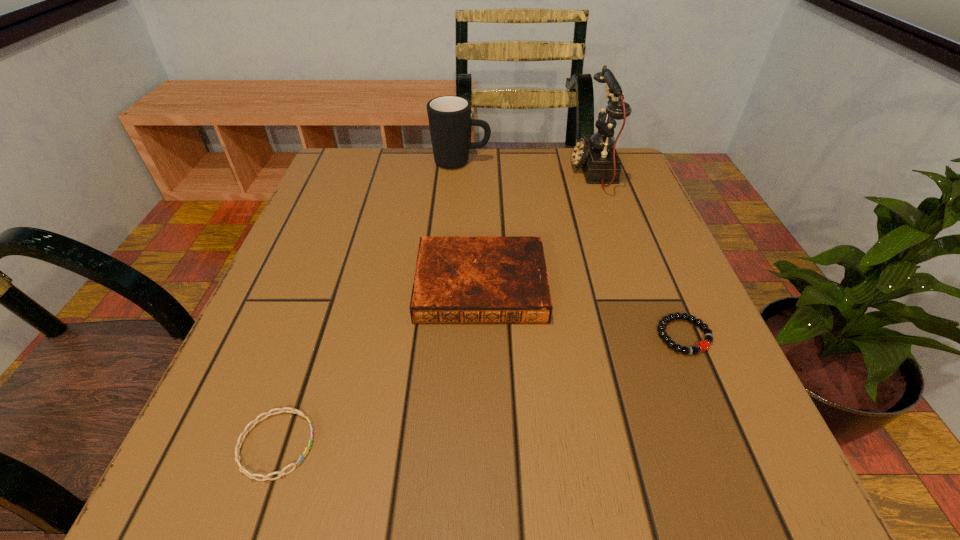
Find the location of `object positioned at the far right corner`. object positioned at the far right corner is located at coordinates (595, 155).

Find the location of a particular element. This screenshot has height=540, width=960. free location at the far edge of the desktop is located at coordinates (453, 188).

Identify the location of free space at the near edge of the desktop. This screenshot has height=540, width=960. (645, 504).

Identify the location of vacant region at the left edge. The image size is (960, 540). (305, 258).

Find the location of a particular element. Image resolution: width=960 pixels, height=540 pixels. free space at the right edge is located at coordinates (659, 369).

In the image, there is a desktop. Where is `vacant area at the far left corner`? This screenshot has width=960, height=540. vacant area at the far left corner is located at coordinates (348, 185).

Locate an element on the screen. This screenshot has height=540, width=960. vacant space at the far right corner of the desktop is located at coordinates (625, 160).

The image size is (960, 540). Find the location of `free space that is in between the Bible and the left bracelet`. free space that is in between the Bible and the left bracelet is located at coordinates (378, 364).

Where is `free space between the telephone and the second tallest object`? Image resolution: width=960 pixels, height=540 pixels. free space between the telephone and the second tallest object is located at coordinates (527, 166).

Find the location of `free space that is in between the nearest object and the right bracelet`. free space that is in between the nearest object and the right bracelet is located at coordinates (480, 390).